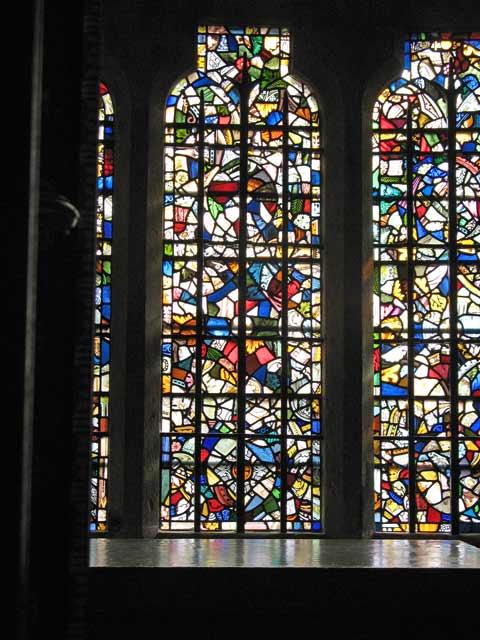
Image resolution: width=480 pixels, height=640 pixels. I want to click on shelf, so coord(293,559).